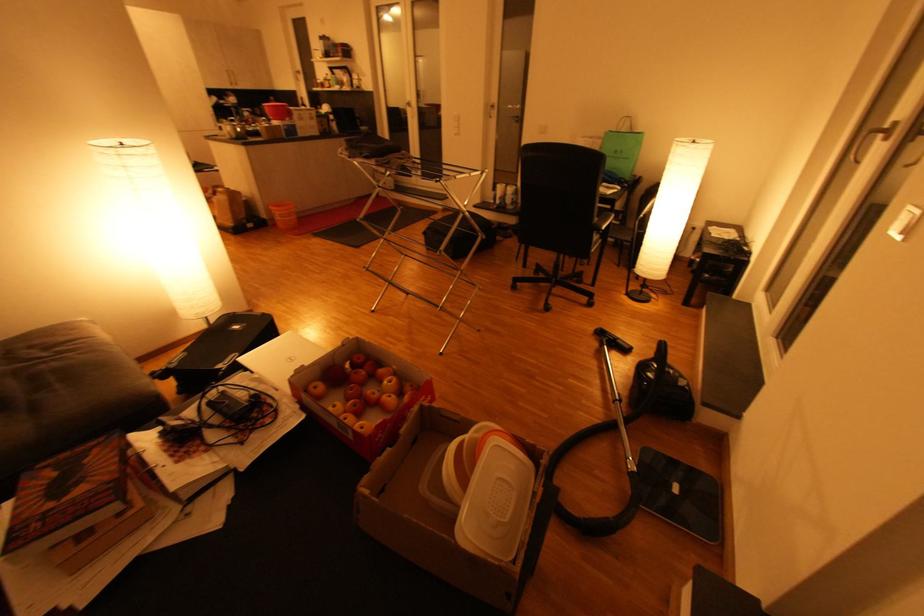
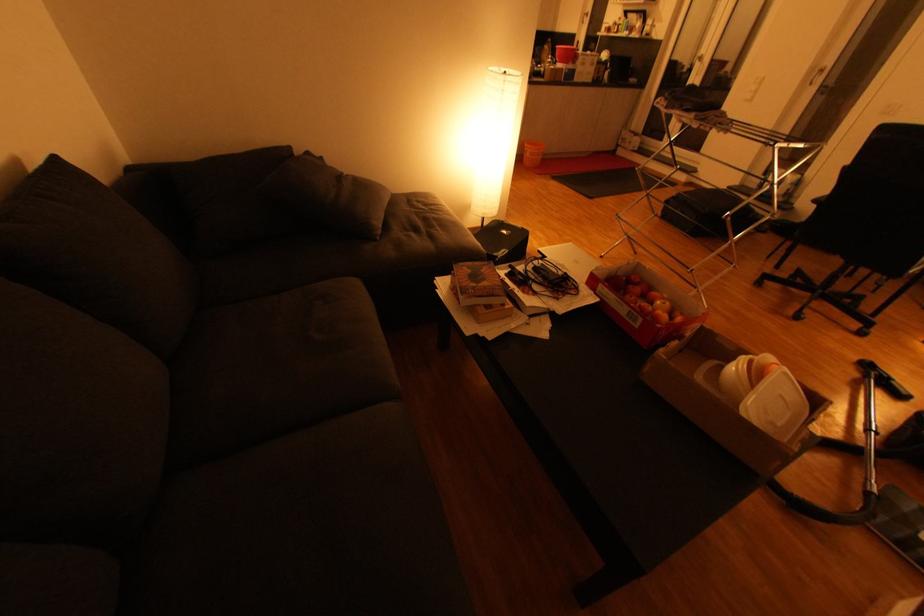
Question: The first image is from the beginning of the video and the second image is from the end. How did the camera likely rotate when shooting the video?

Choices:
 (A) Left
 (B) Right
 (C) Up
 (D) Down

Answer: (A)